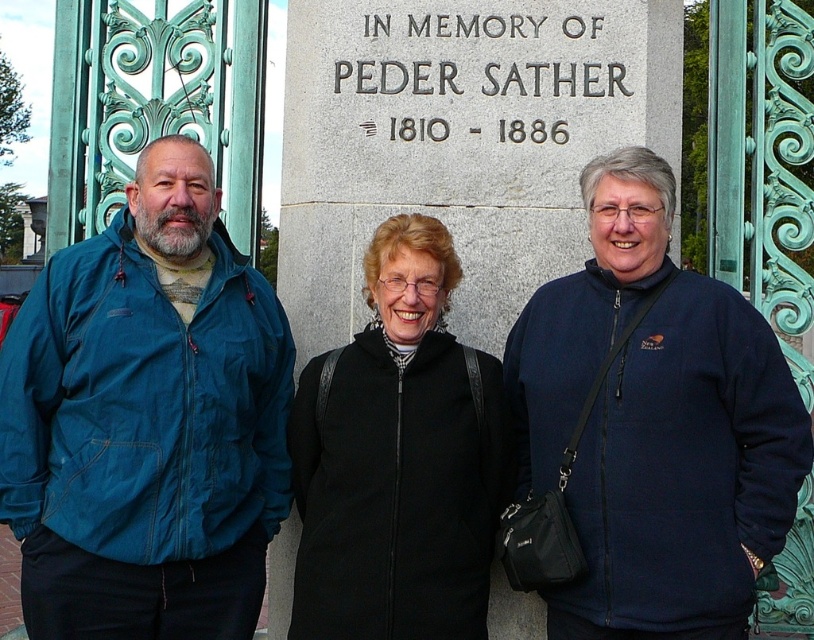
Question: Can you confirm if blue fabric jacket at left is bigger than black matte jacket at center?

Choices:
 (A) yes
 (B) no

Answer: (A)

Question: Does blue fabric jacket at left have a greater width compared to navy fleece jacket at center?

Choices:
 (A) yes
 (B) no

Answer: (A)

Question: Which object is positioned farthest from the black matte jacket at center?

Choices:
 (A) blue fabric jacket at left
 (B) navy fleece jacket at center

Answer: (A)

Question: Based on their relative distances, which object is farther from the navy fleece jacket at center?

Choices:
 (A) black matte jacket at center
 (B) blue fabric jacket at left

Answer: (B)

Question: Does blue fabric jacket at left come behind black matte jacket at center?

Choices:
 (A) yes
 (B) no

Answer: (A)

Question: Which object is farther from the camera taking this photo?

Choices:
 (A) navy fleece jacket at center
 (B) black matte jacket at center
 (C) blue fabric jacket at left

Answer: (C)